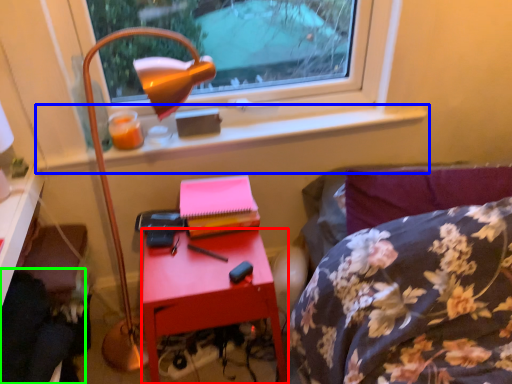
Question: Which object is the closest to the nightstand (highlighted by a red box)? Choose among these: window sill (highlighted by a blue box) or swivel chair (highlighted by a green box).

Choices:
 (A) window sill
 (B) swivel chair

Answer: (B)